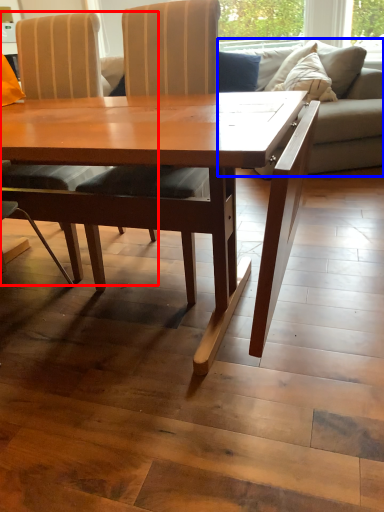
Question: Among these objects, which one is farthest to the camera, chair (highlighted by a red box) or studio couch (highlighted by a blue box)?

Choices:
 (A) chair
 (B) studio couch

Answer: (B)